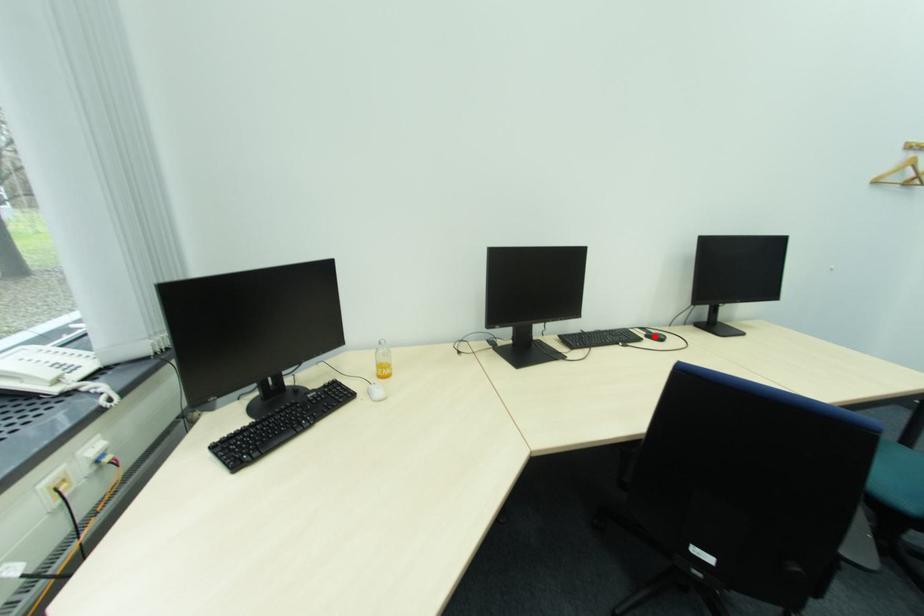
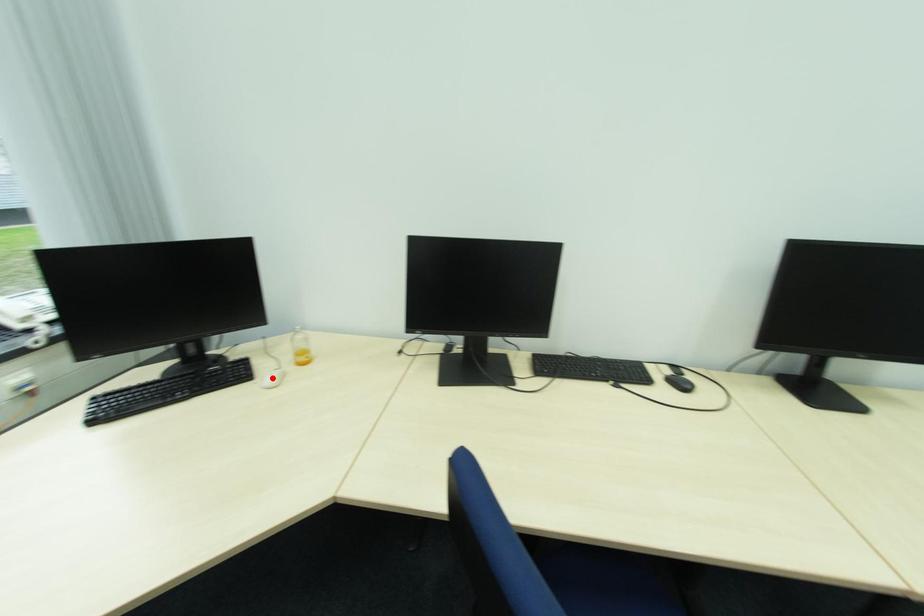
I am providing you with two images of the same scene from different viewpoints. A red point is marked on the first image and another point is marked on the second image. Is the red point in image1 aligned with the point shown in image2?

No